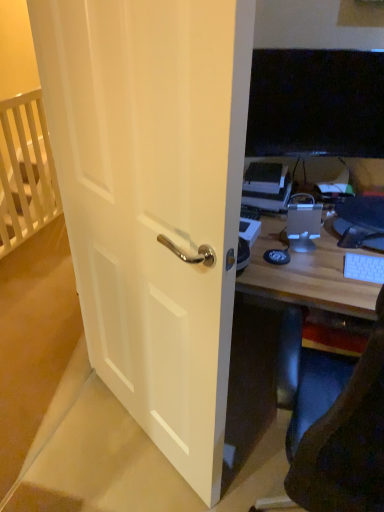
Identify the location of vacant region to the right of black rubber mousepad at center. This screenshot has width=384, height=512. [306, 261].